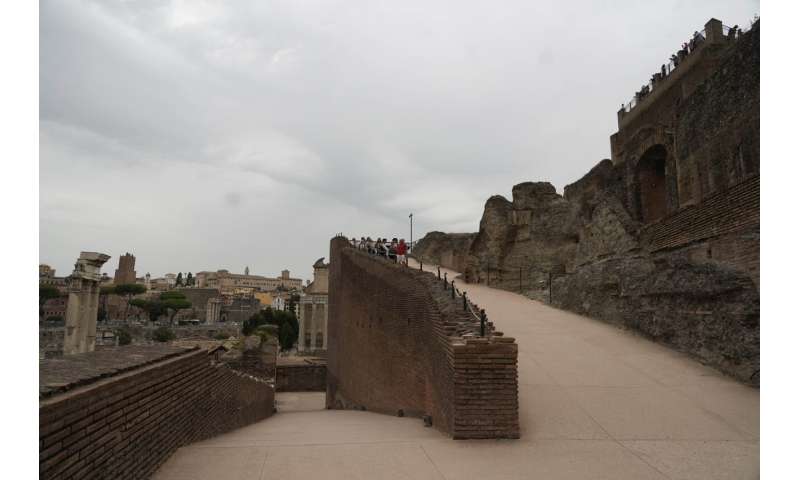
I want to click on brick wall, so tap(145, 407), tap(292, 379), tap(392, 359).